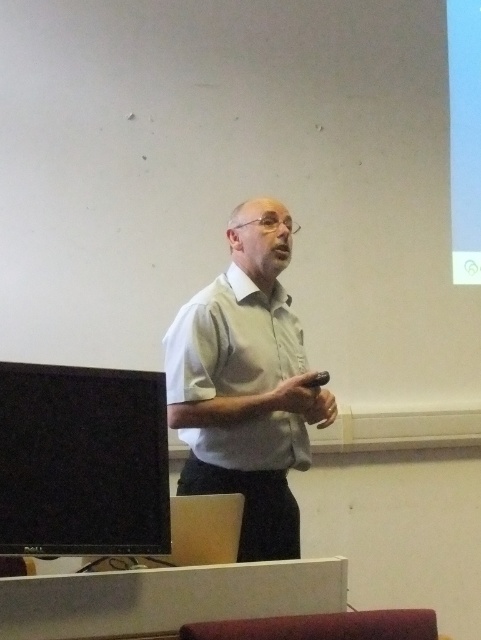
Question: Which of the following is the farthest from the observer?

Choices:
 (A) light gray shirt at center
 (B) black glossy monitor at left

Answer: (A)

Question: Can you confirm if light gray shirt at center is positioned to the right of black glossy monitor at left?

Choices:
 (A) no
 (B) yes

Answer: (B)

Question: Which of the following is the farthest from the observer?

Choices:
 (A) light gray shirt at center
 (B) black glossy monitor at left

Answer: (A)

Question: Observing the image, what is the correct spatial positioning of light gray shirt at center in reference to black glossy monitor at left?

Choices:
 (A) below
 (B) above

Answer: (B)

Question: Which point is closer to the camera?

Choices:
 (A) (250, 538)
 (B) (146, 547)

Answer: (B)

Question: Can you confirm if light gray shirt at center is positioned above black glossy monitor at left?

Choices:
 (A) no
 (B) yes

Answer: (B)